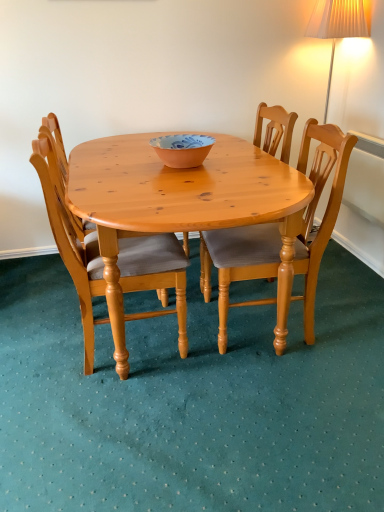
Question: Is light brown wooden chair at center, arranged as the 1th chair when viewed from the right, smaller than matte orange bowl at center?

Choices:
 (A) yes
 (B) no

Answer: (B)

Question: From the image's perspective, is light brown wooden chair at center, arranged as the 1th chair when viewed from the right, located above matte orange bowl at center?

Choices:
 (A) no
 (B) yes

Answer: (A)

Question: Does light brown wooden chair at center, positioned as the 3th chair in left-to-right order, have a greater height compared to matte orange bowl at center?

Choices:
 (A) no
 (B) yes

Answer: (B)

Question: Is light brown wooden chair at center, arranged as the 1th chair when viewed from the right, not close to matte orange bowl at center?

Choices:
 (A) no
 (B) yes

Answer: (A)

Question: Does light brown wooden chair at center, arranged as the 1th chair when viewed from the right, have a lesser height compared to matte orange bowl at center?

Choices:
 (A) yes
 (B) no

Answer: (B)

Question: In terms of width, does light brown wooden chair at center, arranged as the 1th chair when viewed from the right, look wider or thinner when compared to pine wood chair at center, the 1th chair when ordered from left to right?

Choices:
 (A) thin
 (B) wide

Answer: (B)

Question: In the image, is light brown wooden chair at center, positioned as the 3th chair in left-to-right order, positioned in front of or behind pine wood chair at center, the 1th chair when ordered from left to right?

Choices:
 (A) behind
 (B) front

Answer: (A)

Question: From a real-world perspective, is light brown wooden chair at center, positioned as the 3th chair in left-to-right order, positioned above or below pine wood chair at center, the 1th chair when ordered from left to right?

Choices:
 (A) below
 (B) above

Answer: (B)

Question: Visually, is light brown wooden chair at center, arranged as the 1th chair when viewed from the right, positioned to the left or to the right of pine wood chair at center, the 1th chair when ordered from left to right?

Choices:
 (A) left
 (B) right

Answer: (B)

Question: From the image's perspective, is light brown wooden chair at center, arranged as the 1th chair when viewed from the right, positioned above or below wooden chair at center, the second chair from the right?

Choices:
 (A) below
 (B) above

Answer: (A)

Question: Is point (342, 145) closer or farther from the camera than point (264, 243)?

Choices:
 (A) farther
 (B) closer

Answer: (B)

Question: Considering their positions, is light brown wooden chair at center, positioned as the 3th chair in left-to-right order, located in front of or behind wooden chair at center, the second chair from the right?

Choices:
 (A) front
 (B) behind

Answer: (A)

Question: In terms of width, does light brown wooden chair at center, arranged as the 1th chair when viewed from the right, look wider or thinner when compared to wooden chair at center, which is the second chair in left-to-right order?

Choices:
 (A) thin
 (B) wide

Answer: (B)

Question: Relative to wooden chair at center, the second chair from the right, is pine wood chair at center, which is the third chair from right to left, in front or behind?

Choices:
 (A) front
 (B) behind

Answer: (A)

Question: From a real-world perspective, relative to wooden chair at center, which is the second chair in left-to-right order, is pine wood chair at center, which is the third chair from right to left, vertically above or below?

Choices:
 (A) above
 (B) below

Answer: (B)